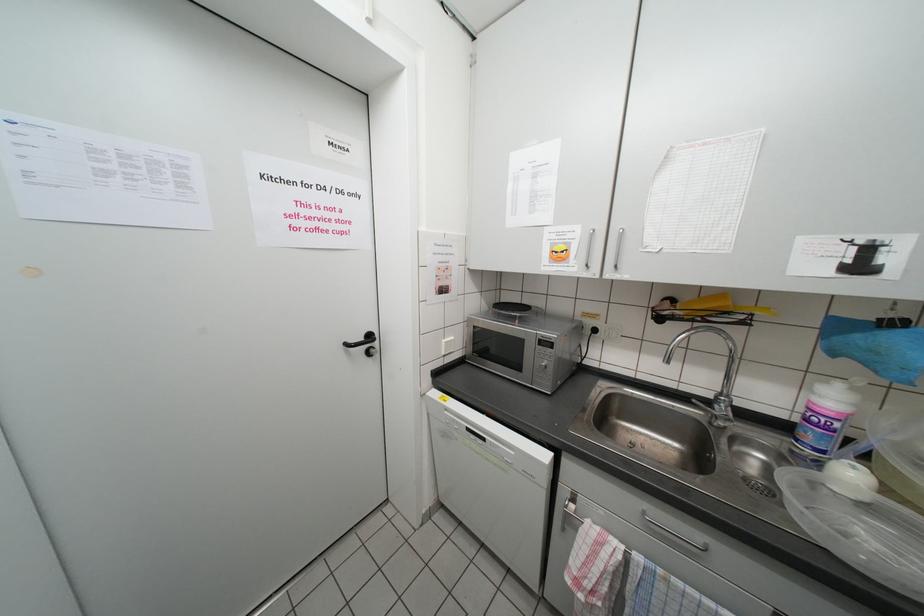
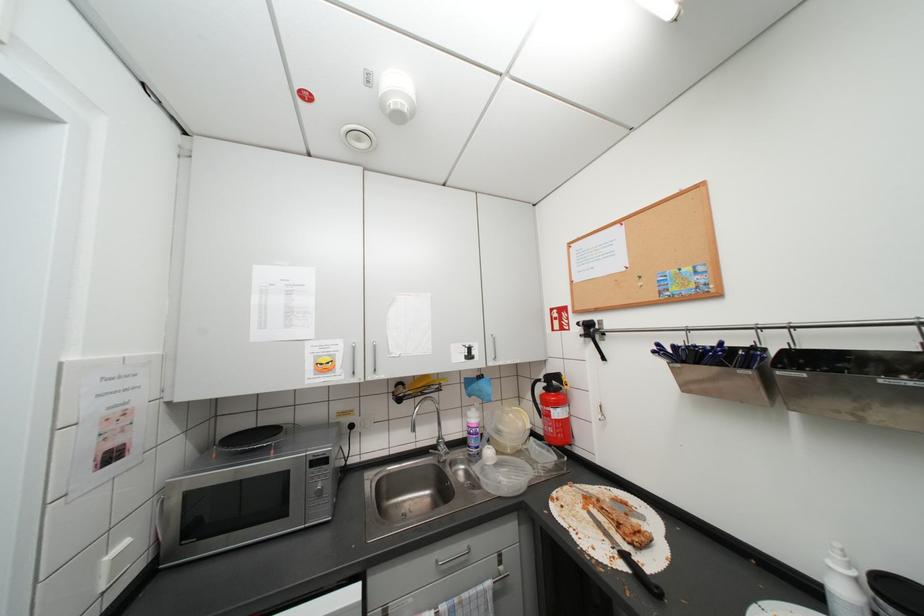
Question: The camera is either moving clockwise (left) or counter-clockwise (right) around the object. The first image is from the beginning of the video and the second image is from the end. Is the camera moving left or right when shooting the video?

Choices:
 (A) Left
 (B) Right

Answer: (A)